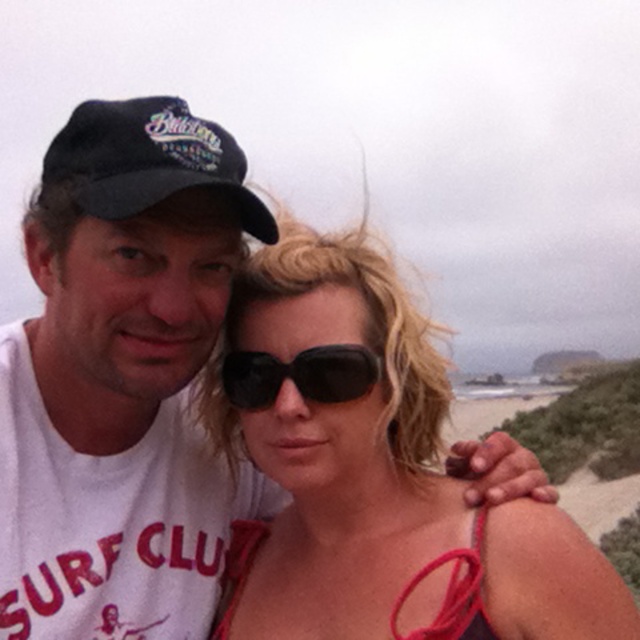
You are a photographer trying to capture a closeup of the black fabric baseball cap at upper left and the black matte sunglasses at center. Which object should you zoom in on more to ensure both are equally visible in the photo?

The black fabric baseball cap at upper left is bigger than the black matte sunglasses at center, so you should zoom in slightly more on the black matte sunglasses at center to balance their sizes in the photo.

You are a photographer trying to capture a candid shot of the two people in the scene. You need to ensure that both the matte black sunglasses at center and the black fabric baseball cap at upper left are in focus. Given that your camera has a depth of field that can cover objects within a 1 meter range, will you be able to achieve this?

The matte black sunglasses at center and the black fabric baseball cap at upper left are 1.08 meters apart. Since the distance between them exceeds the camera s 1 meter depth of field range, achieving focus on both simultaneously may not be possible.

Looking at this image, you are standing at the center of the image and want to locate the black fabric baseball cap at upper left. In which direction should you look to find it?

The black fabric baseball cap at upper left is located at point [148,161], so you should look to the upper left direction to find it.